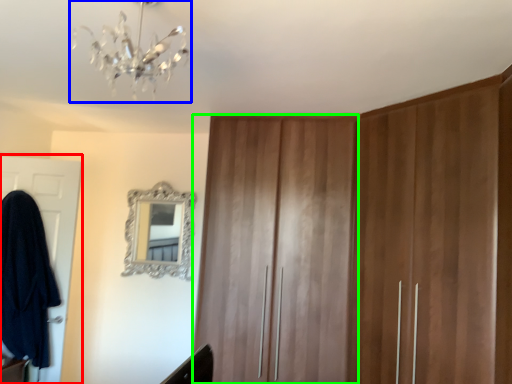
Question: Estimate the real-world distances between objects in this image. Which object is closer to door (highlighted by a red box), light fixture (highlighted by a blue box) or locker (highlighted by a green box)?

Choices:
 (A) light fixture
 (B) locker

Answer: (B)